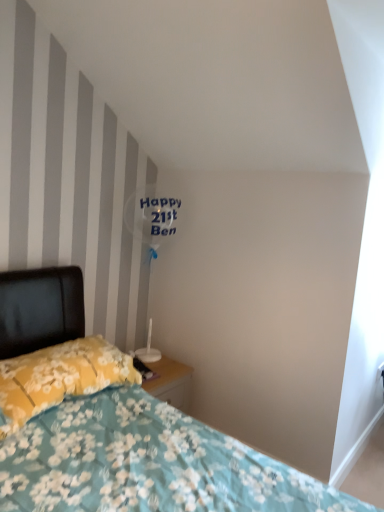
Find the location of a particular element. floral fabric bed at lower left is located at coordinates (145, 463).

Measure the distance between floral fabric bed at lower left and camera.

4.04 feet.

Measure the distance between point (61, 296) and camera.

The depth of point (61, 296) is 2.09 meters.

What do you see at coordinates (145, 463) in the screenshot? The image size is (384, 512). I see `floral fabric bed at lower left` at bounding box center [145, 463].

Where is `yellow floral fabric pillow at lower left`? yellow floral fabric pillow at lower left is located at coordinates (59, 377).

Measure the distance between yellow floral fabric pillow at lower left and camera.

They are 1.48 meters apart.

The image size is (384, 512). What do you see at coordinates (59, 377) in the screenshot? I see `yellow floral fabric pillow at lower left` at bounding box center [59, 377].

This screenshot has width=384, height=512. In order to click on floral fabric bed at lower left in this screenshot , I will do `click(145, 463)`.

Considering the positions of objects yellow floral fabric pillow at lower left and floral fabric bed at lower left in the image provided, who is more to the right, yellow floral fabric pillow at lower left or floral fabric bed at lower left?

Positioned to the right is floral fabric bed at lower left.

Relative to floral fabric bed at lower left, is yellow floral fabric pillow at lower left in front or behind?

yellow floral fabric pillow at lower left is behind floral fabric bed at lower left.

Is point (109, 356) behind point (190, 459)?

Yes, point (109, 356) is behind point (190, 459).

From the image's perspective, is yellow floral fabric pillow at lower left beneath floral fabric bed at lower left?

Actually, yellow floral fabric pillow at lower left appears above floral fabric bed at lower left in the image.

From a real-world perspective, which is physically below, yellow floral fabric pillow at lower left or floral fabric bed at lower left?

In real-world perspective, yellow floral fabric pillow at lower left is lower.

Between yellow floral fabric pillow at lower left and floral fabric bed at lower left, which one has smaller width?

With smaller width is yellow floral fabric pillow at lower left.

In the scene shown: Does yellow floral fabric pillow at lower left have a lesser height compared to floral fabric bed at lower left?

Indeed, yellow floral fabric pillow at lower left has a lesser height compared to floral fabric bed at lower left.

Considering the sizes of objects yellow floral fabric pillow at lower left and floral fabric bed at lower left in the image provided, who is bigger, yellow floral fabric pillow at lower left or floral fabric bed at lower left?

floral fabric bed at lower left.

Would you say yellow floral fabric pillow at lower left contains floral fabric bed at lower left?

No, yellow floral fabric pillow at lower left does not contain floral fabric bed at lower left.

In the scene shown: Is yellow floral fabric pillow at lower left placed right next to floral fabric bed at lower left?

yellow floral fabric pillow at lower left is not next to floral fabric bed at lower left, and they're not touching.

Does yellow floral fabric pillow at lower left turn towards floral fabric bed at lower left?

Yes, yellow floral fabric pillow at lower left is aimed at floral fabric bed at lower left.

How different are the orientations of yellow floral fabric pillow at lower left and floral fabric bed at lower left in degrees?

The angle between the facing direction of yellow floral fabric pillow at lower left and the facing direction of floral fabric bed at lower left is 0.468 degrees.

Find the location of a particular element. The width and height of the screenshot is (384, 512). bed in front of the yellow floral fabric pillow at lower left is located at coordinates (145, 463).

Is floral fabric bed at lower left to the right of yellow floral fabric pillow at lower left from the viewer's perspective?

Yes.

Is floral fabric bed at lower left further to camera compared to yellow floral fabric pillow at lower left?

No, the depth of floral fabric bed at lower left is less than that of yellow floral fabric pillow at lower left.

Considering the positions of points (167, 428) and (105, 361), is point (167, 428) closer to camera compared to point (105, 361)?

Yes, it is in front of point (105, 361).

From the image's perspective, which one is positioned lower, floral fabric bed at lower left or yellow floral fabric pillow at lower left?

floral fabric bed at lower left is shown below in the image.

From a real-world perspective, is floral fabric bed at lower left physically below yellow floral fabric pillow at lower left?

No.

Which of these two, floral fabric bed at lower left or yellow floral fabric pillow at lower left, is wider?

Wider between the two is floral fabric bed at lower left.

Can you confirm if floral fabric bed at lower left is shorter than yellow floral fabric pillow at lower left?

In fact, floral fabric bed at lower left may be taller than yellow floral fabric pillow at lower left.

Can you confirm if floral fabric bed at lower left is bigger than yellow floral fabric pillow at lower left?

Indeed, floral fabric bed at lower left has a larger size compared to yellow floral fabric pillow at lower left.

Is floral fabric bed at lower left completely or partially outside of yellow floral fabric pillow at lower left?

That's correct, floral fabric bed at lower left is outside of yellow floral fabric pillow at lower left.

Looking at this image, is floral fabric bed at lower left far away from yellow floral fabric pillow at lower left?

No.

In the scene shown: Is yellow floral fabric pillow at lower left at the back of floral fabric bed at lower left?

Yes, floral fabric bed at lower left's orientation is away from yellow floral fabric pillow at lower left.

How distant is floral fabric bed at lower left from yellow floral fabric pillow at lower left?

A distance of 9.07 inches exists between floral fabric bed at lower left and yellow floral fabric pillow at lower left.

This screenshot has width=384, height=512. Identify the location of bed located on the right of yellow floral fabric pillow at lower left. (145, 463).

Identify the location of bed located below the yellow floral fabric pillow at lower left (from the image's perspective). The image size is (384, 512). (145, 463).

You are a GUI agent. You are given a task and a screenshot of the screen. Output one action in this format:
    pyautogui.click(x=<x>, y=<y>)
    Task: Click on the pillow behind the floral fabric bed at lower left
    Image resolution: width=384 pixels, height=512 pixels.
    Given the screenshot: What is the action you would take?
    pyautogui.click(x=59, y=377)